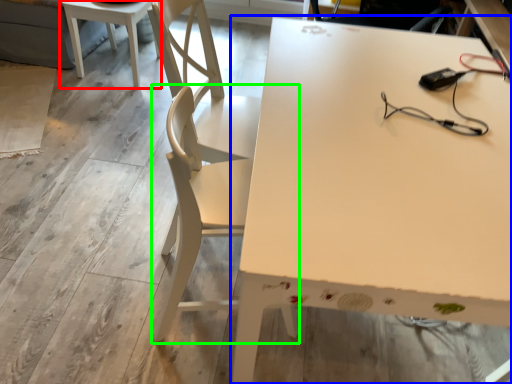
Question: Estimate the real-world distances between objects in this image. Which object is farther from table (highlighted by a red box), table (highlighted by a blue box) or chair (highlighted by a green box)?

Choices:
 (A) table
 (B) chair

Answer: (A)